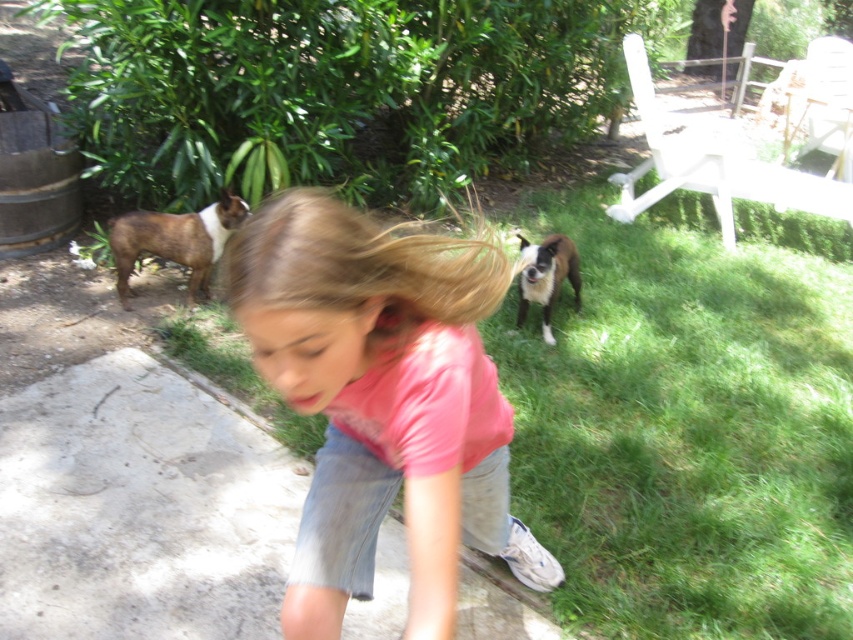
Question: Estimate the real-world distances between objects in this image. Which object is farther from the blonde smooth hair at center?

Choices:
 (A) brown fur dog at left
 (B) pink cotton shirt at center
 (C) white plastic chair at upper right
 (D) brown fur dog at center

Answer: (C)

Question: Which of the following is the farthest from the observer?

Choices:
 (A) (386, 300)
 (B) (711, 177)

Answer: (B)

Question: From the image, what is the correct spatial relationship of blonde smooth hair at center in relation to white plastic chair at upper right?

Choices:
 (A) right
 (B) left

Answer: (B)

Question: Which point appears closest to the camera in this image?

Choices:
 (A) (543, 257)
 (B) (200, 292)
 (C) (337, 208)

Answer: (C)

Question: Can you confirm if pink cotton shirt at center is positioned below blonde smooth hair at center?

Choices:
 (A) no
 (B) yes

Answer: (B)

Question: Does pink cotton shirt at center lie in front of white plastic chair at upper right?

Choices:
 (A) yes
 (B) no

Answer: (A)